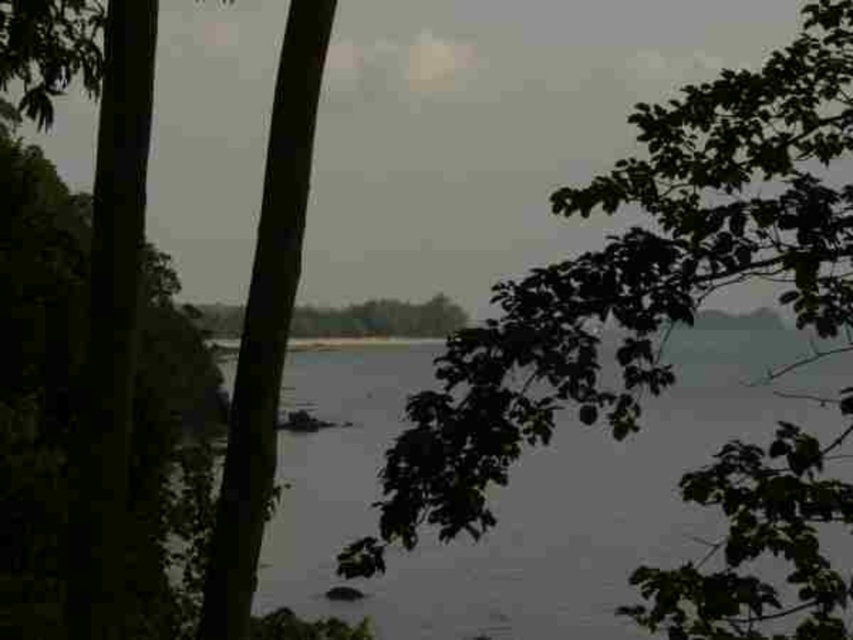
Is green leafy tree at upper right to the right of clear water at center from the viewer's perspective?

Indeed, green leafy tree at upper right is positioned on the right side of clear water at center.

Is green leafy tree at upper right bigger than clear water at center?

Yes, green leafy tree at upper right is bigger than clear water at center.

Is point (598, 196) closer to camera compared to point (654, 403)?

That is True.

The width and height of the screenshot is (853, 640). Find the location of `green leafy tree at upper right`. green leafy tree at upper right is located at coordinates (641, 276).